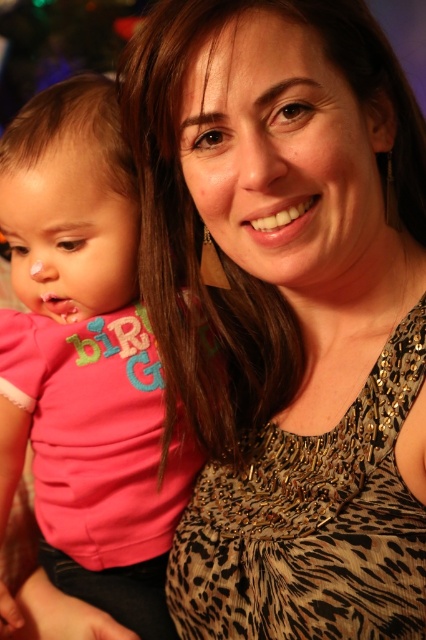
Question: Considering the relative positions of leopard print tank top at center and pink fabric shirt at left in the image provided, where is leopard print tank top at center located with respect to pink fabric shirt at left?

Choices:
 (A) left
 (B) right

Answer: (B)

Question: Which point is farther to the camera?

Choices:
 (A) pink fabric shirt at left
 (B) leopard print tank top at center

Answer: (A)

Question: Which of the following is the closest to the observer?

Choices:
 (A) pink fabric shirt at left
 (B) leopard print tank top at center

Answer: (B)

Question: Can you confirm if leopard print tank top at center is wider than pink fabric shirt at left?

Choices:
 (A) no
 (B) yes

Answer: (B)

Question: Is leopard print tank top at center smaller than pink fabric shirt at left?

Choices:
 (A) yes
 (B) no

Answer: (B)